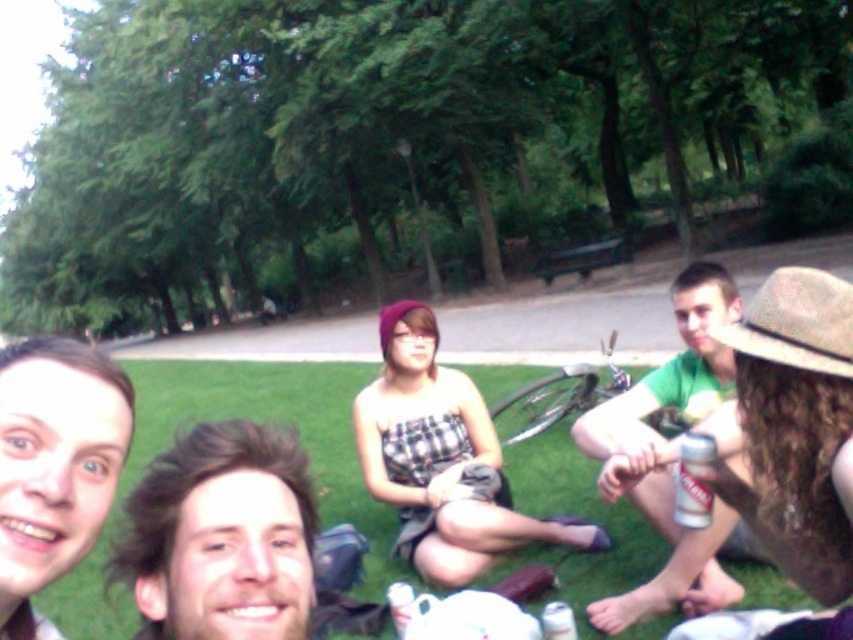
Consider the image. Is green grass at lower center wider than green matte shirt at center?

Correct, the width of green grass at lower center exceeds that of green matte shirt at center.

The image size is (853, 640). Find the location of `green grass at lower center`. green grass at lower center is located at coordinates (225, 417).

Who is lower down, green matte shirt at center or silver metallic can at lower right?

green matte shirt at center is lower down.

Which is in front, point (706, 342) or point (693, 515)?

Point (693, 515) is more forward.

Which is in front, point (722, 570) or point (705, 499)?

Point (705, 499)

Identify the location of green matte shirt at center. Image resolution: width=853 pixels, height=640 pixels. (671, 454).

The height and width of the screenshot is (640, 853). What do you see at coordinates (225, 417) in the screenshot?
I see `green grass at lower center` at bounding box center [225, 417].

Who is shorter, green grass at lower center or silver metallic can at lower right?

With less height is silver metallic can at lower right.

Who is more distant from viewer, (347, 465) or (676, 468)?

The point (347, 465) is more distant.

You are a GUI agent. You are given a task and a screenshot of the screen. Output one action in this format:
    pyautogui.click(x=<x>, y=<y>)
    Task: Click on the green grass at lower center
    
    Given the screenshot: What is the action you would take?
    pyautogui.click(x=225, y=417)